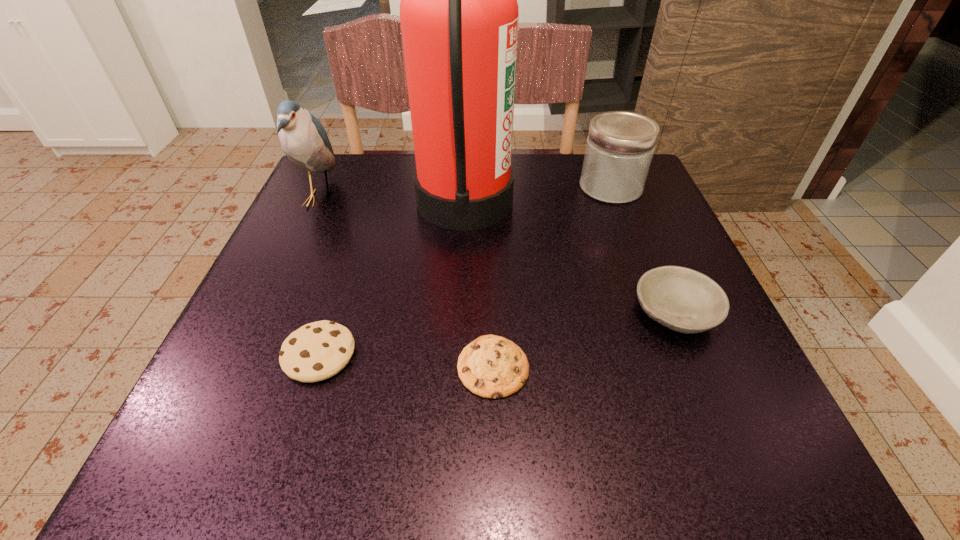
Where is `empty location between the leftmost object and the shorter cookie`? This screenshot has width=960, height=540. empty location between the leftmost object and the shorter cookie is located at coordinates (406, 282).

This screenshot has width=960, height=540. I want to click on unoccupied position between the taller cookie and the shortest object, so click(x=406, y=360).

Locate an element on the screen. The height and width of the screenshot is (540, 960). free area in between the bowl and the bird is located at coordinates (497, 255).

This screenshot has height=540, width=960. I want to click on free spot between the bowl and the fourth shortest object, so click(x=643, y=250).

This screenshot has width=960, height=540. I want to click on vacant space that's between the fifth shortest object and the fifth object from right to left, so click(319, 276).

Find the location of a particular element. The image size is (960, 540). free space between the tallest object and the fifth shortest object is located at coordinates (392, 199).

You are a GUI agent. You are given a task and a screenshot of the screen. Output one action in this format:
    pyautogui.click(x=<x>, y=<y>)
    Task: Click on the empty space that is in between the tallest object and the fourth shortest object
    This screenshot has width=960, height=540.
    Given the screenshot: What is the action you would take?
    pyautogui.click(x=538, y=194)

At what (x,y) coordinates should I click in order to perform the action: click on object that is the fourth closest to the fire extinguisher. Please return your answer as a coordinate pair (x, y). This screenshot has width=960, height=540. Looking at the image, I should click on (491, 366).

This screenshot has height=540, width=960. Identify the location of the fifth closest object to the taller cookie. (620, 145).

Where is `vacant space that satisfies the following two spatial constraints: 1. at the tip of the taller cookie's beak; 2. on the right side of the bird`? The image size is (960, 540). vacant space that satisfies the following two spatial constraints: 1. at the tip of the taller cookie's beak; 2. on the right side of the bird is located at coordinates (247, 354).